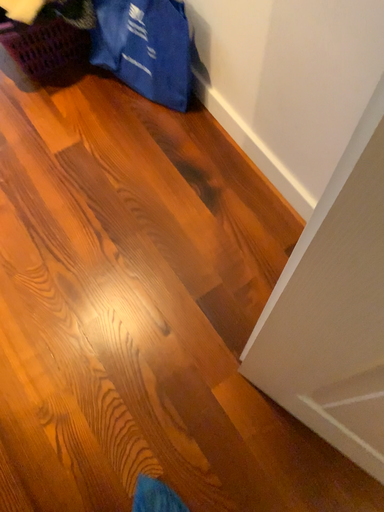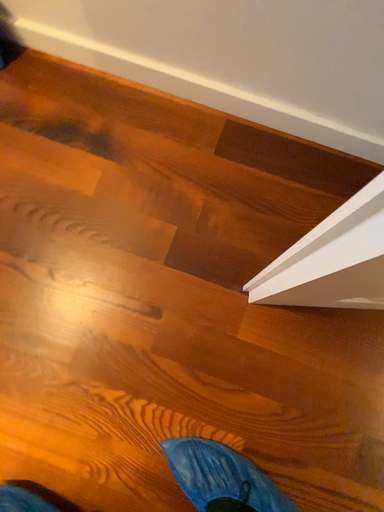
Question: How did the camera likely rotate when shooting the video?

Choices:
 (A) rotated left
 (B) rotated right

Answer: (B)